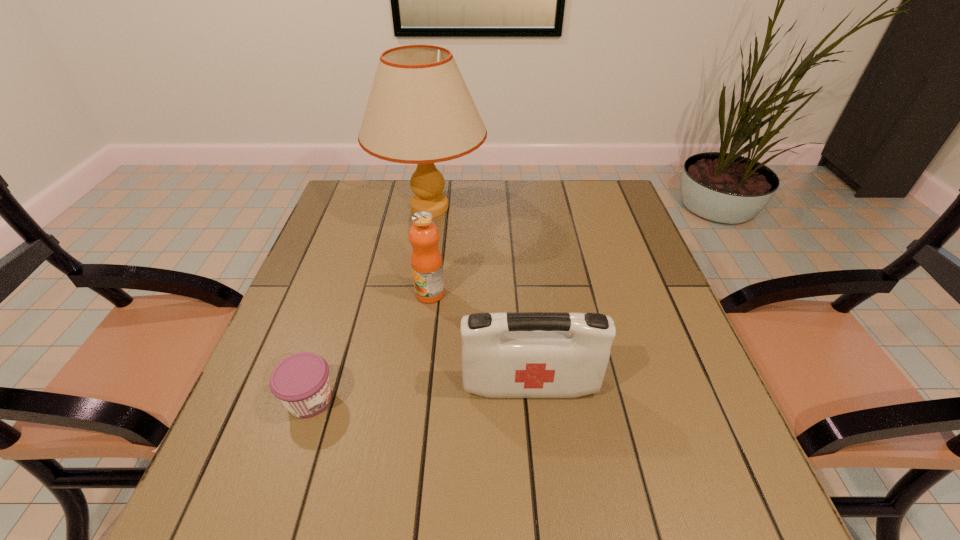
Identify the location of lampshade. (420, 111).

Where is `the tallest object`? This screenshot has width=960, height=540. the tallest object is located at coordinates (420, 111).

This screenshot has height=540, width=960. What are the coordinates of `fruit juice` in the screenshot? It's located at (426, 261).

Identify the location of the first-aid kit. The image size is (960, 540). (517, 354).

Locate an element on the screen. the shortest object is located at coordinates (301, 382).

Find the location of `vacant space located on the front of the farthest object`. vacant space located on the front of the farthest object is located at coordinates (408, 352).

Find the location of a particular element. This screenshot has width=960, height=540. vacant space situated on the back of the third nearest object is located at coordinates (437, 237).

Locate an element on the screen. This screenshot has width=960, height=540. vacant space positioned on the front side of the first-aid kit is located at coordinates (535, 433).

What are the coordinates of `free space located 0.240m on the front label of the shortest object` in the screenshot? It's located at (458, 399).

You are a GUI agent. You are given a task and a screenshot of the screen. Output one action in this format:
    pyautogui.click(x=<x>, y=<y>)
    Task: Click on the object present at the far edge
    The width and height of the screenshot is (960, 540).
    Given the screenshot: What is the action you would take?
    pyautogui.click(x=420, y=111)